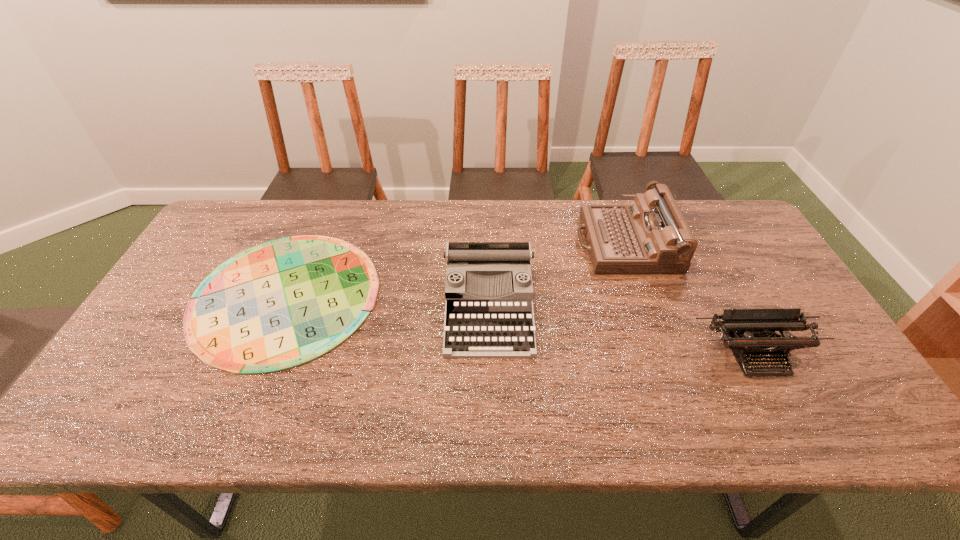
At what (x,y) coordinates should I click in order to perform the action: click on vacant space that satisfies the following two spatial constraints: 1. on the keyboard of the tallest object; 2. on the typing side of the third object from right to left. Please return your answer as a coordinate pair (x, y). Looking at the image, I should click on (647, 307).